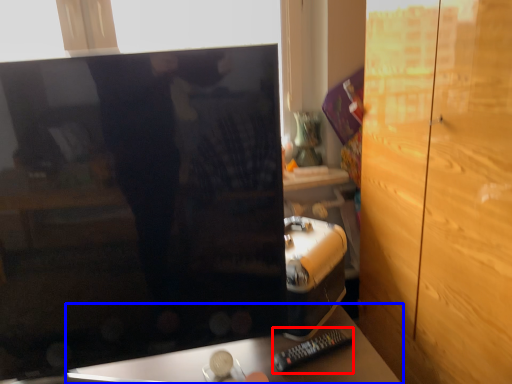
Question: Which object is further to the camera taking this photo, remote (highlighted by a red box) or furniture (highlighted by a blue box)?

Choices:
 (A) remote
 (B) furniture

Answer: (A)